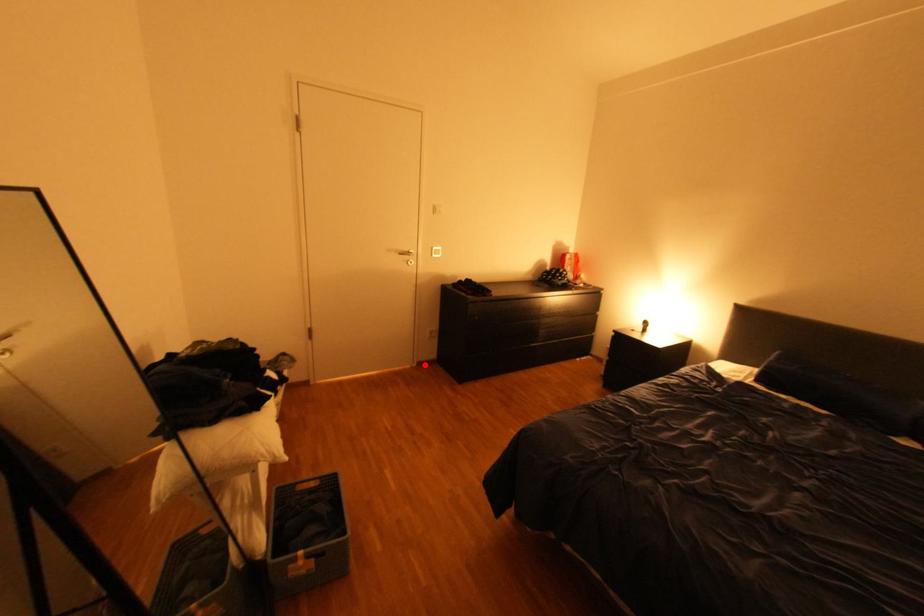
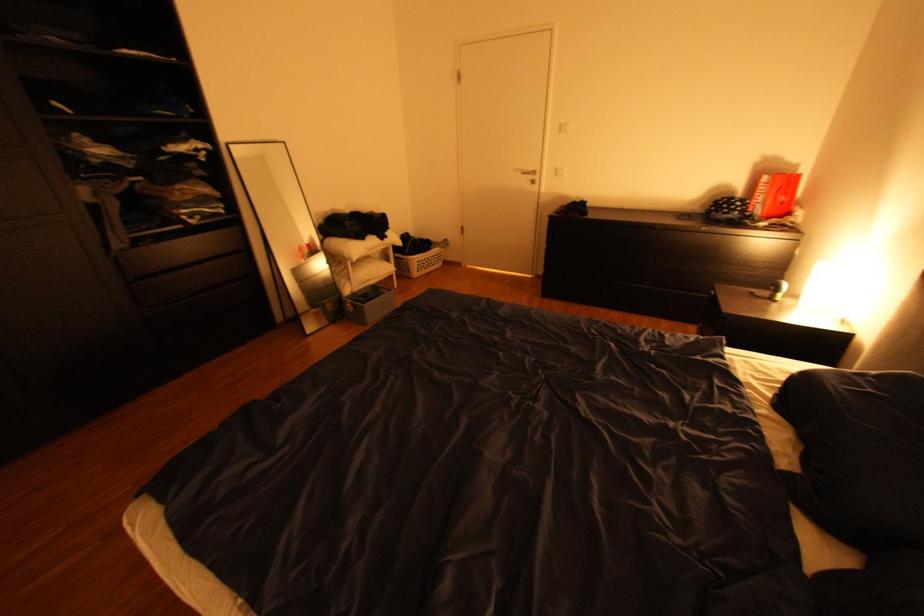
Question: I am providing you with two images of the same scene from different viewpoints. In image1, a red point is highlighted. Considering the same 3D point in image2, which of the following is correct?

Choices:
 (A) It is closer
 (B) It is farther

Answer: (A)